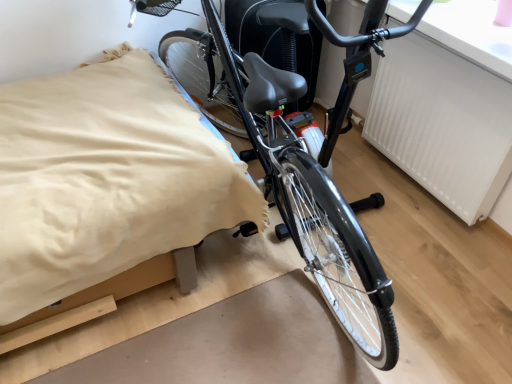
Question: Is white textured radiator at upper right placed right next to beige fabric bed at center?

Choices:
 (A) yes
 (B) no

Answer: (B)

Question: Does white textured radiator at upper right appear on the right side of beige fabric bed at center?

Choices:
 (A) yes
 (B) no

Answer: (A)

Question: Is white textured radiator at upper right thinner than beige fabric bed at center?

Choices:
 (A) no
 (B) yes

Answer: (B)

Question: Would you say white textured radiator at upper right contains beige fabric bed at center?

Choices:
 (A) yes
 (B) no

Answer: (B)

Question: Can we say white textured radiator at upper right lies outside beige fabric bed at center?

Choices:
 (A) yes
 (B) no

Answer: (A)

Question: Looking at their shapes, would you say beige fabric bed at center is wider or thinner than shiny black bicycle at center?

Choices:
 (A) thin
 (B) wide

Answer: (A)

Question: From the image's perspective, is beige fabric bed at center above or below shiny black bicycle at center?

Choices:
 (A) below
 (B) above

Answer: (A)

Question: Is point (40, 279) positioned closer to the camera than point (352, 314)?

Choices:
 (A) farther
 (B) closer

Answer: (B)

Question: Considering the positions of beige fabric bed at center and shiny black bicycle at center in the image, is beige fabric bed at center bigger or smaller than shiny black bicycle at center?

Choices:
 (A) big
 (B) small

Answer: (B)

Question: Relative to beige fabric bed at center, is shiny black bicycle at center in front or behind?

Choices:
 (A) behind
 (B) front

Answer: (B)

Question: In terms of width, does shiny black bicycle at center look wider or thinner when compared to beige fabric bed at center?

Choices:
 (A) wide
 (B) thin

Answer: (A)

Question: Looking at the image, does shiny black bicycle at center seem bigger or smaller compared to beige fabric bed at center?

Choices:
 (A) small
 (B) big

Answer: (B)

Question: Considering the relative positions of shiny black bicycle at center and beige fabric bed at center in the image provided, is shiny black bicycle at center to the left or to the right of beige fabric bed at center?

Choices:
 (A) left
 (B) right

Answer: (B)

Question: Do you think white textured radiator at upper right is within beige fabric bed at center, or outside of it?

Choices:
 (A) inside
 (B) outside

Answer: (B)

Question: Is point pyautogui.click(x=464, y=89) closer or farther from the camera than point pyautogui.click(x=98, y=216)?

Choices:
 (A) farther
 (B) closer

Answer: (A)